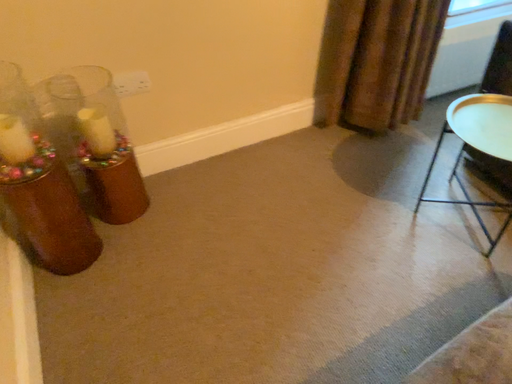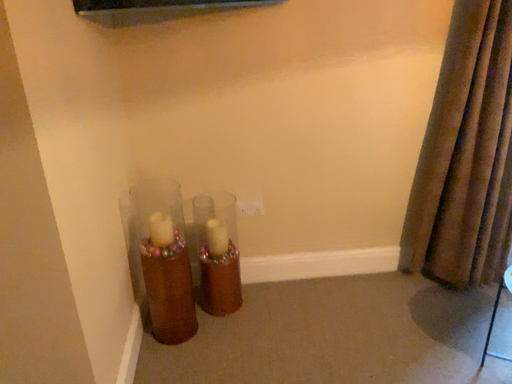
Question: How did the camera likely rotate when shooting the video?

Choices:
 (A) rotated downward
 (B) rotated upward

Answer: (B)